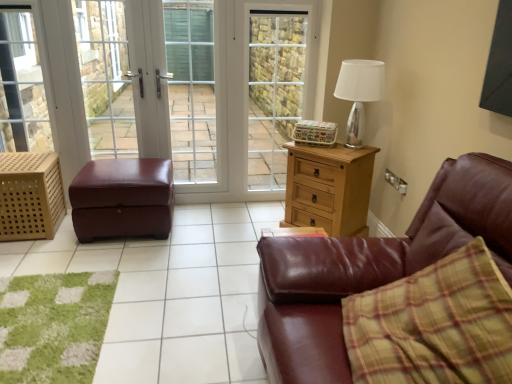
Where is `free location to the right of burgundy leather ottoman at left`? The width and height of the screenshot is (512, 384). free location to the right of burgundy leather ottoman at left is located at coordinates (218, 234).